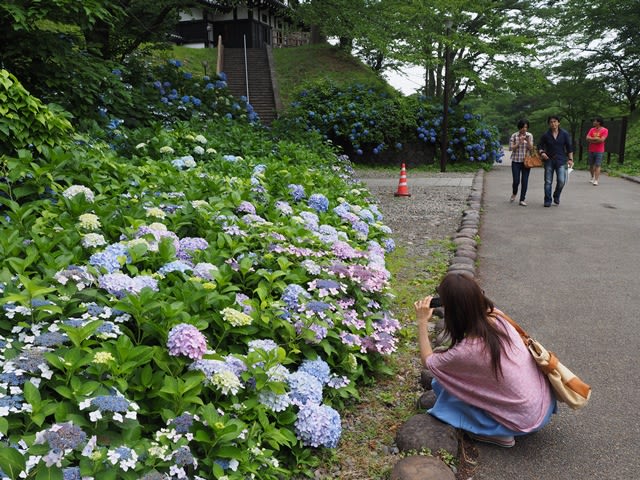
I want to click on staircase, so click(257, 80), click(234, 69).